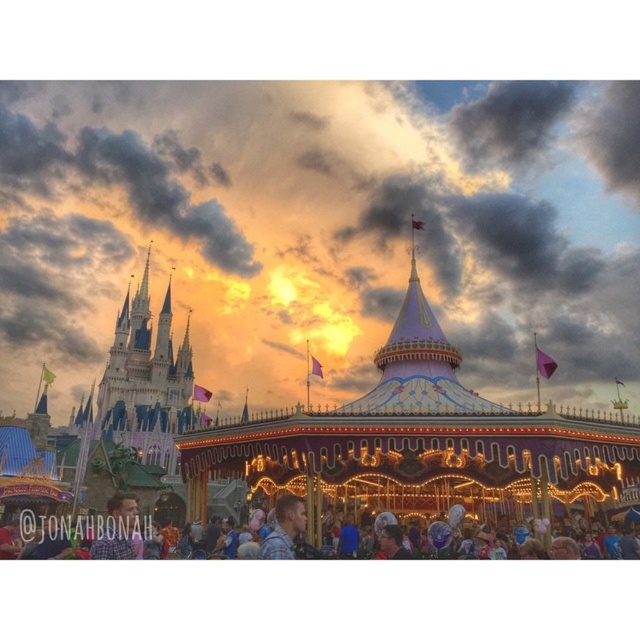
Question: Is blue plaid shirt at lower center wider than plaid shirt at center?

Choices:
 (A) yes
 (B) no

Answer: (A)

Question: Which of the following is the farthest from the observer?

Choices:
 (A) 497,424
 (B) 109,541
 (C) 120,493

Answer: (C)

Question: Does shiny metallic carousel at center come behind plaid shirt at center?

Choices:
 (A) no
 (B) yes

Answer: (B)

Question: Considering the real-world distances, which object is farthest from the plaid shirt at center?

Choices:
 (A) shiny metallic carousel at center
 (B) plaid shirt at lower center

Answer: (A)

Question: Which object is positioned farthest from the plaid shirt at center?

Choices:
 (A) plaid shirt at lower center
 (B) blue plaid shirt at lower center
 (C) shiny metallic carousel at center

Answer: (C)

Question: Is shiny metallic carousel at center wider than plaid shirt at lower center?

Choices:
 (A) yes
 (B) no

Answer: (A)